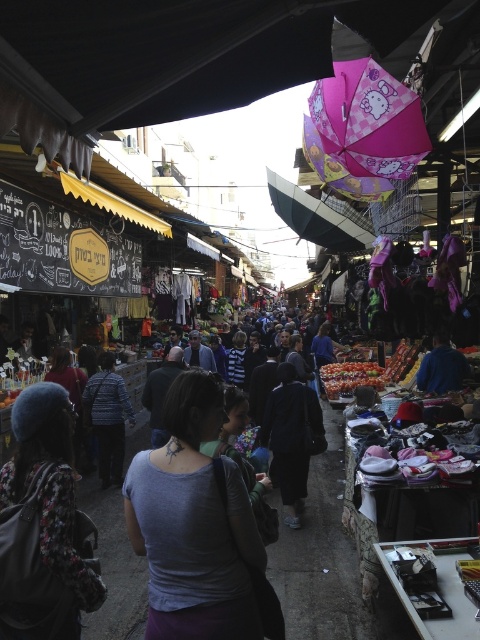
You are a customer at the market and want to buy the floral fabric jacket at lower left. Where exactly is it located in the image?

The floral fabric jacket at lower left is located at point [48,508].

In the bustling outdoor market under the black canopy, you notice a purple matte shirt at center and a floral fabric jacket at lower left. Which item takes up more space in the scene?

The purple matte shirt at center is larger in size than the floral fabric jacket at lower left, so it takes up more space in the scene.